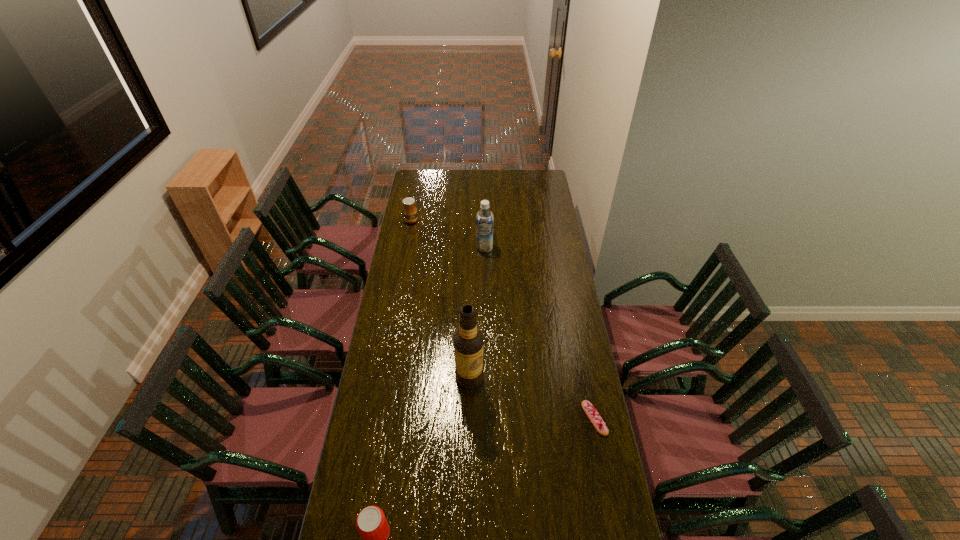
Where is `free space on the desktop that is between the beer can and the rightmost object and is positioned on the label of the tallest object`? Image resolution: width=960 pixels, height=540 pixels. free space on the desktop that is between the beer can and the rightmost object and is positioned on the label of the tallest object is located at coordinates (498, 469).

This screenshot has height=540, width=960. Identify the location of free space on the desktop that is between the nearest object and the eclair and is positioned on the front-facing side of the honey. (522, 456).

This screenshot has height=540, width=960. In order to click on free spot on the desktop that is between the beer can and the shortest object and is positioned on the label of the second farthest object in this screenshot , I will do `click(468, 485)`.